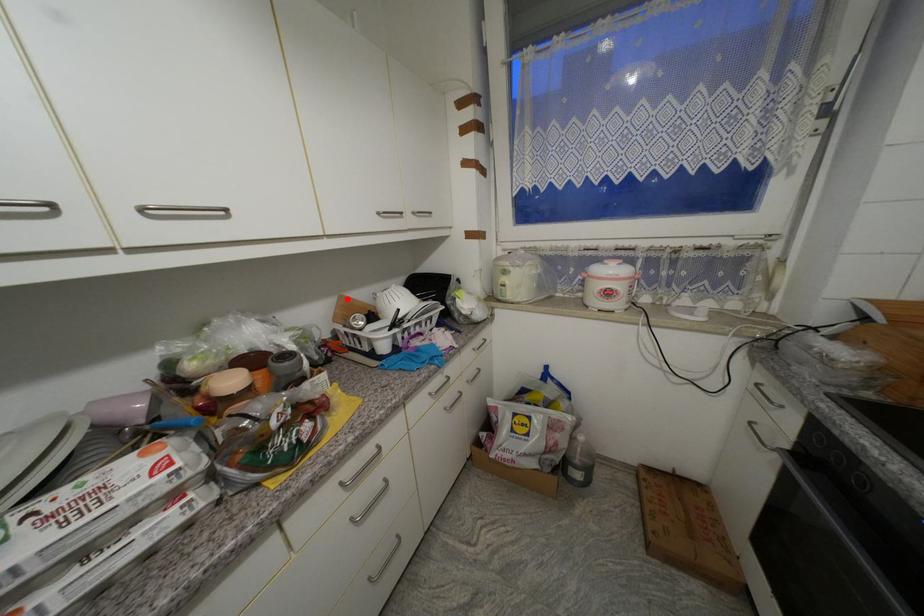
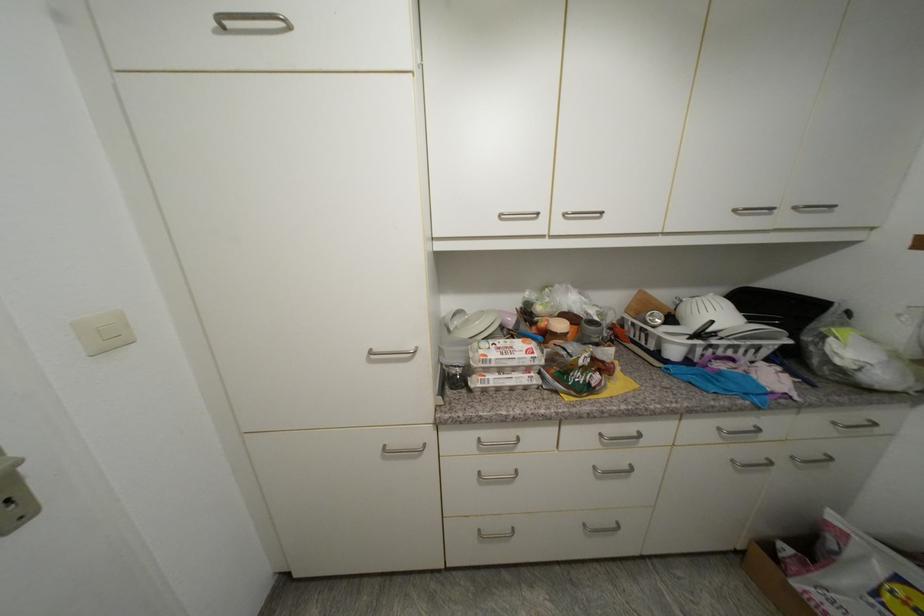
Locate, in the second image, the point that corresponds to the highlighted location in the first image.

(647, 294)